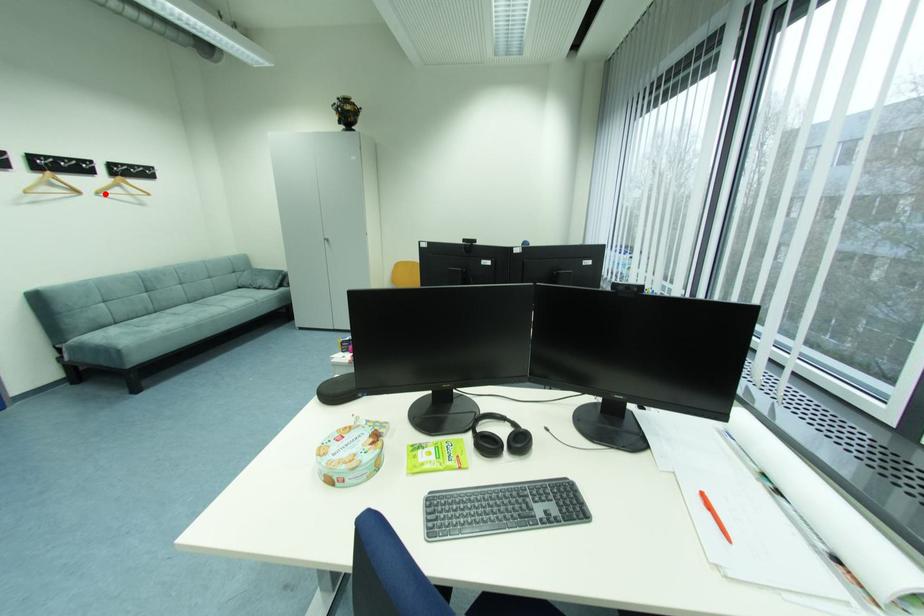
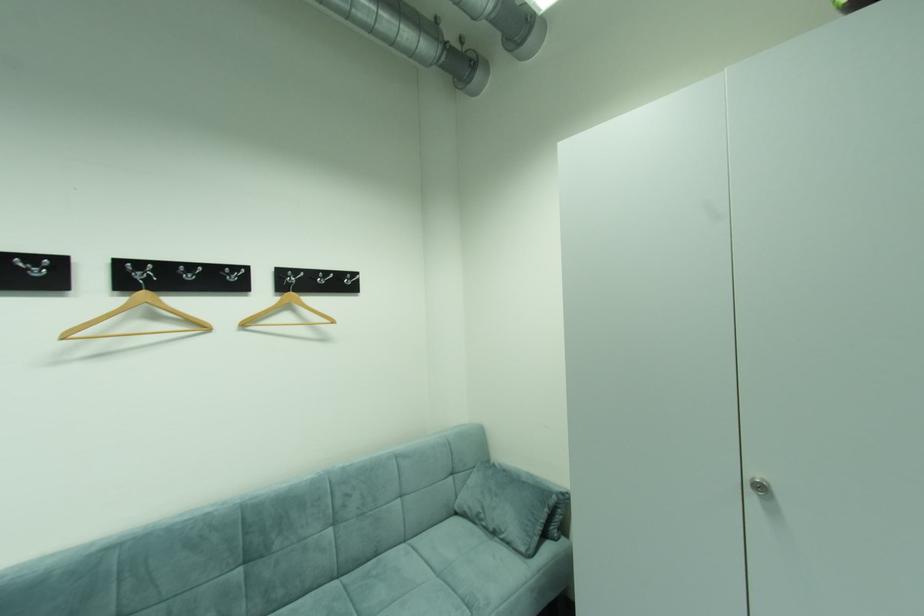
Where in the second image is the point corresponding to the highlighted location from the first image?

(251, 326)